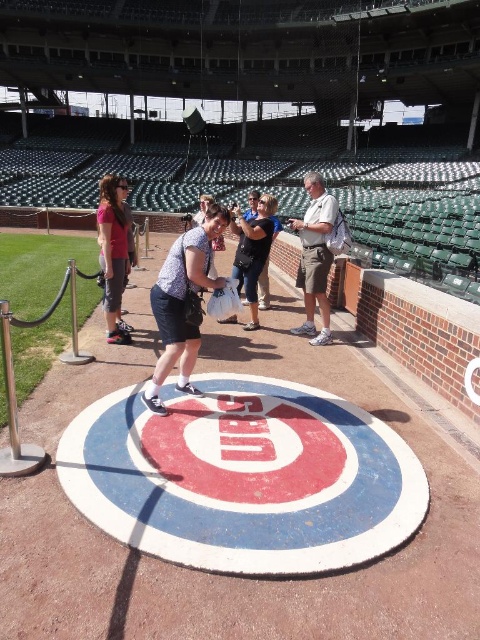
Question: From the image, what is the correct spatial relationship of khaki shorts at center in relation to denim shorts at center?

Choices:
 (A) below
 (B) above

Answer: (A)

Question: Estimate the real-world distances between objects in this image. Which object is closer to the khaki shorts at center?

Choices:
 (A) matte pink shirt at left
 (B) matte blue shorts at center
 (C) denim shorts at center

Answer: (C)

Question: Where is matte pink shirt at left located in relation to denim shorts at center in the image?

Choices:
 (A) below
 (B) above

Answer: (A)

Question: Which point appears farthest from the camera in this image?

Choices:
 (A) (113, 212)
 (B) (310, 288)
 (C) (187, 300)
 (D) (254, 289)

Answer: (D)

Question: Does matte pink shirt at left lie in front of denim shorts at center?

Choices:
 (A) yes
 (B) no

Answer: (A)

Question: Which of these objects is positioned closest to the matte pink shirt at left?

Choices:
 (A) matte blue shorts at center
 (B) denim shorts at center
 (C) khaki shorts at center

Answer: (B)